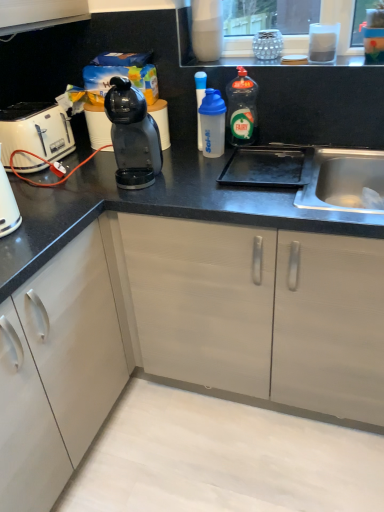
Where is `free space above white plastic toaster at left (from a real-world perspective)`? free space above white plastic toaster at left (from a real-world perspective) is located at coordinates click(22, 110).